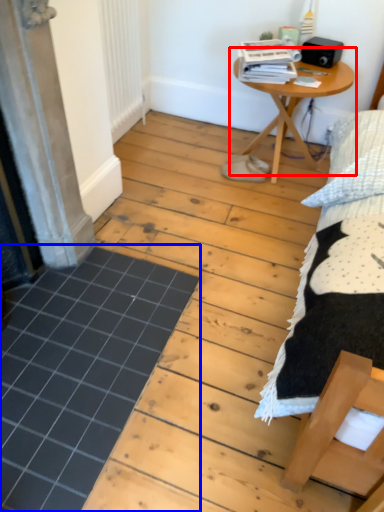
Question: Which object is further to the camera taking this photo, table (highlighted by a red box) or plank (highlighted by a blue box)?

Choices:
 (A) table
 (B) plank

Answer: (A)